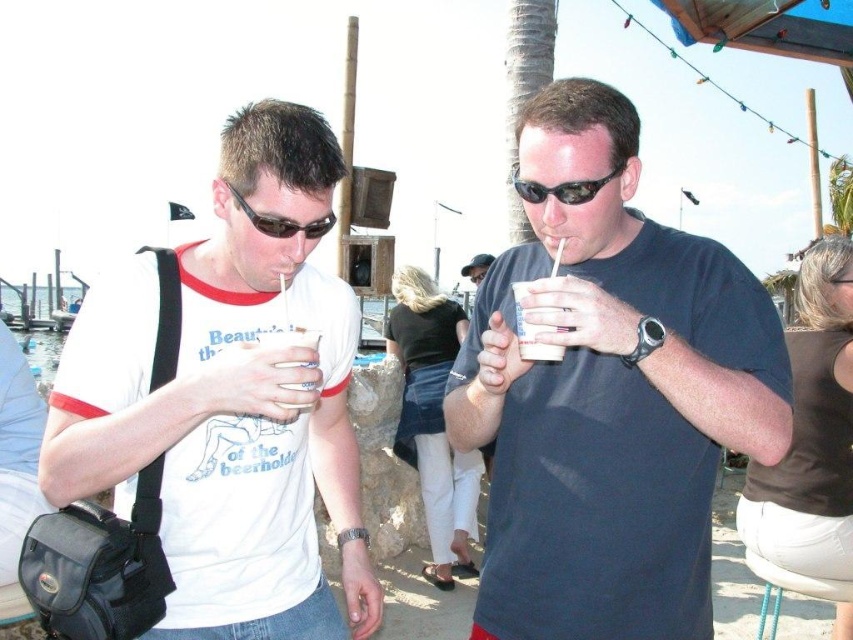
From the picture: Can you confirm if matte black cup at center is positioned to the right of black plastic sunglasses at center?

Indeed, matte black cup at center is positioned on the right side of black plastic sunglasses at center.

In the scene shown: Can you confirm if matte black cup at center is shorter than black plastic sunglasses at center?

No.

Find the location of a particular element. matte black cup at center is located at coordinates (608, 396).

From the picture: Does white matte t-shirt at left have a greater height compared to black plastic sunglasses at center?

Yes.

At what (x,y) coordinates should I click in order to perform the action: click on white matte t-shirt at left. Please return your answer as a coordinate pair (x, y). This screenshot has width=853, height=640. Looking at the image, I should click on (230, 403).

Is the position of matte black cup at center more distant than that of matte black sunglasses at upper center?

No, matte black cup at center is closer to the viewer.

Is matte black cup at center closer to camera compared to matte black sunglasses at upper center?

That is True.

Where is `matte black cup at center`? matte black cup at center is located at coordinates [x=608, y=396].